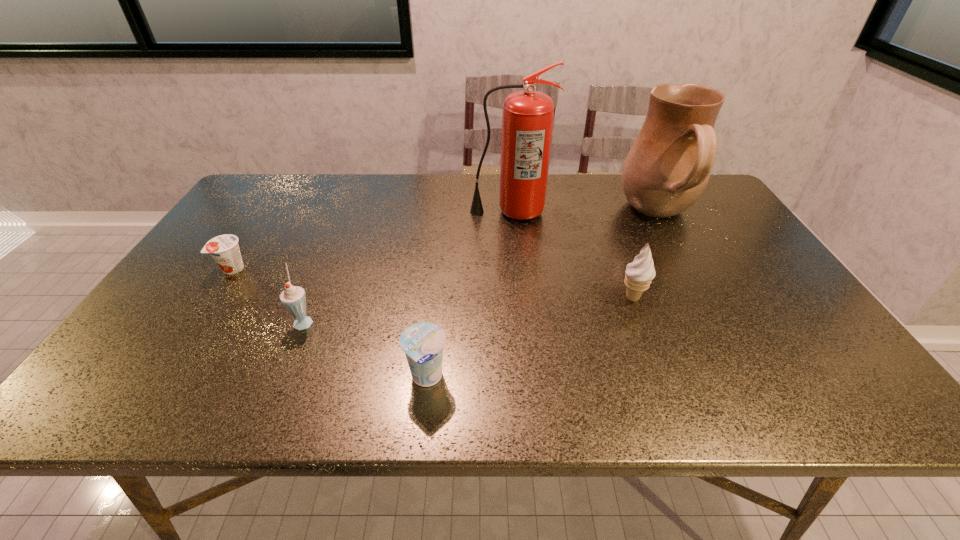
Where is `blank space at the left edge of the desktop`? Image resolution: width=960 pixels, height=540 pixels. blank space at the left edge of the desktop is located at coordinates (276, 217).

Find the location of a particular element. free region at the right edge is located at coordinates (817, 350).

The image size is (960, 540). I want to click on vacant area at the near left corner of the desktop, so click(135, 410).

In the image, there is a desktop. Identify the location of vacant space at the far right corner. (717, 198).

At what (x,y) coordinates should I click in order to perform the action: click on empty space between the fifth object from left to right and the fourth object from left to right. Please return your answer as a coordinate pair (x, y). This screenshot has width=960, height=540. Looking at the image, I should click on (571, 255).

I want to click on vacant area between the icecream and the fifth tallest object, so click(x=530, y=338).

Identify the location of vacant space that is in between the rightmost object and the fifth tallest object. The width and height of the screenshot is (960, 540). (542, 296).

Where is `empty space that is in between the fourth object from left to right and the second shortest object`? The height and width of the screenshot is (540, 960). empty space that is in between the fourth object from left to right and the second shortest object is located at coordinates (468, 295).

Where is `empty location between the fifth farthest object and the fifth tallest object`? empty location between the fifth farthest object and the fifth tallest object is located at coordinates (366, 349).

You are a GUI agent. You are given a task and a screenshot of the screen. Output one action in this format:
    pyautogui.click(x=<x>, y=<y>)
    Task: Click on the empty space that is in between the second tallest object and the second nearest object
    Image resolution: width=960 pixels, height=540 pixels.
    Given the screenshot: What is the action you would take?
    pyautogui.click(x=482, y=268)